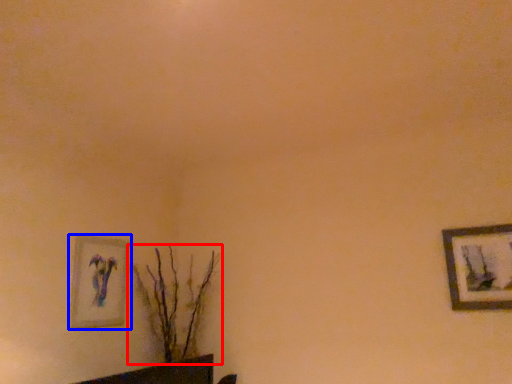
Question: Which object appears closest to the camera in this image, houseplant (highlighted by a red box) or picture frame (highlighted by a blue box)?

Choices:
 (A) houseplant
 (B) picture frame

Answer: (B)